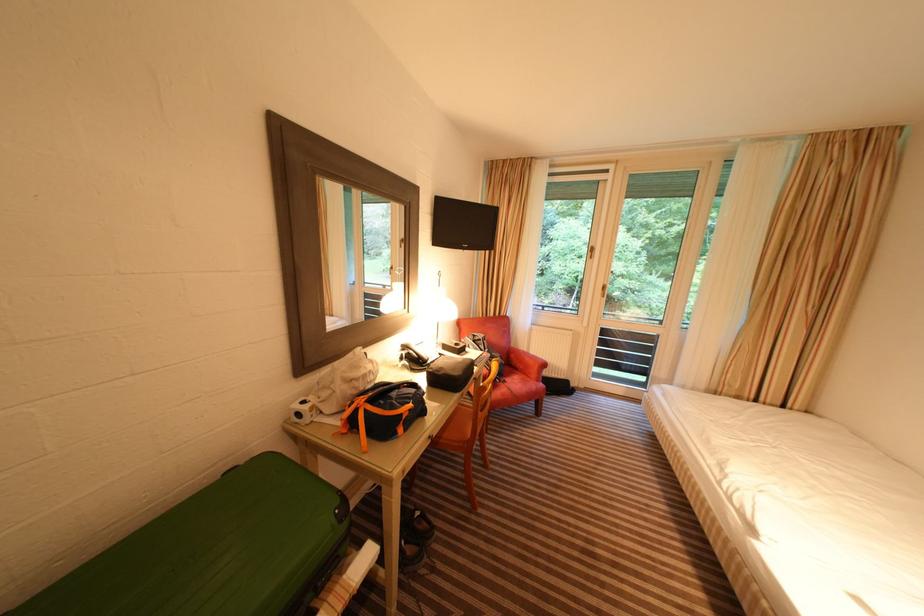
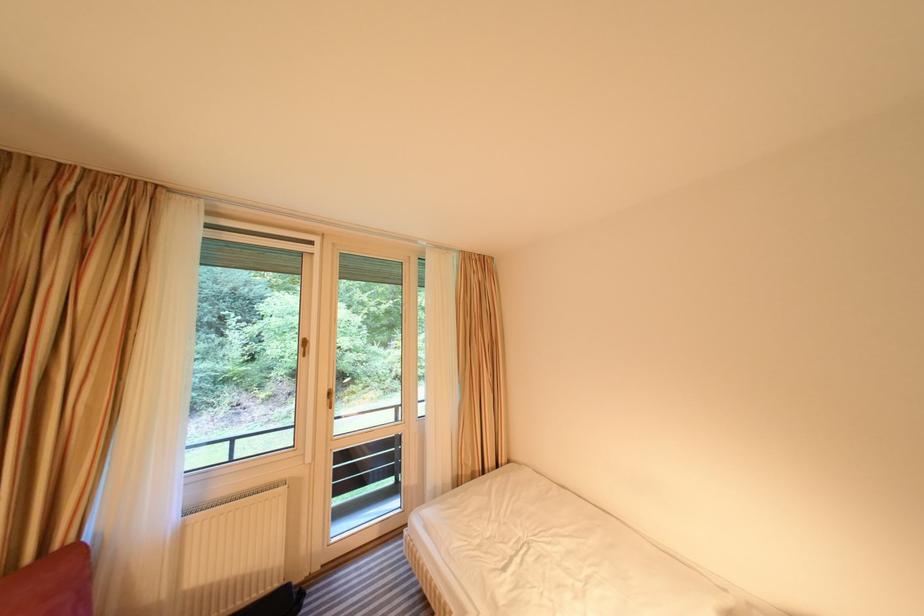
Where in the second image is the point corresponding to (508,323) from the first image?

(57, 578)